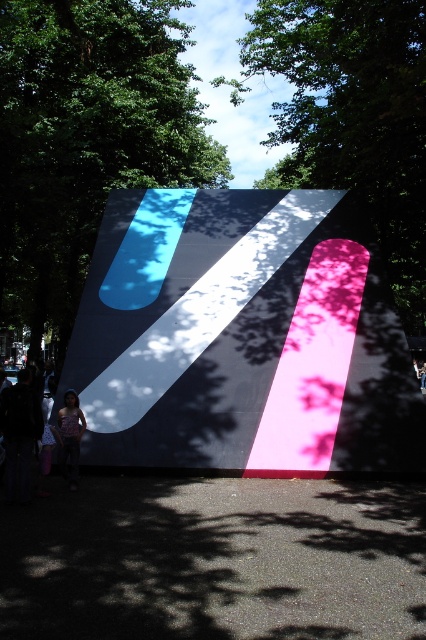
Does green leafy tree at upper center have a greater width compared to matte pink dress at lower left?

Correct, the width of green leafy tree at upper center exceeds that of matte pink dress at lower left.

Does green leafy tree at upper center have a greater height compared to matte pink dress at lower left?

Yes.

Measure the distance between point (299,131) and camera.

The distance of point (299,131) from camera is 65.56 feet.

You are a GUI agent. You are given a task and a screenshot of the screen. Output one action in this format:
    pyautogui.click(x=<x>, y=<y>)
    Task: Click on the green leafy tree at upper center
    This screenshot has width=426, height=640.
    Given the screenshot: What is the action you would take?
    pyautogui.click(x=354, y=116)

Can you confirm if green leafy tree at center is positioned above denim shorts at lower left?

Yes, green leafy tree at center is above denim shorts at lower left.

Which is more to the left, green leafy tree at center or denim shorts at lower left?

green leafy tree at center is more to the left.

Between point (131, 152) and point (60, 426), which one is positioned in front?

Point (60, 426)

Where is `green leafy tree at center`? The height and width of the screenshot is (640, 426). green leafy tree at center is located at coordinates (86, 140).

Which is below, matte pink dress at lower left or denim shorts at lower left?

Positioned lower is matte pink dress at lower left.

How much distance is there between matte pink dress at lower left and denim shorts at lower left?

27.98 centimeters

Is point (34, 422) positioned in front of point (77, 417)?

Yes.

Identify the location of matte pink dress at lower left. This screenshot has width=426, height=640. (20, 435).